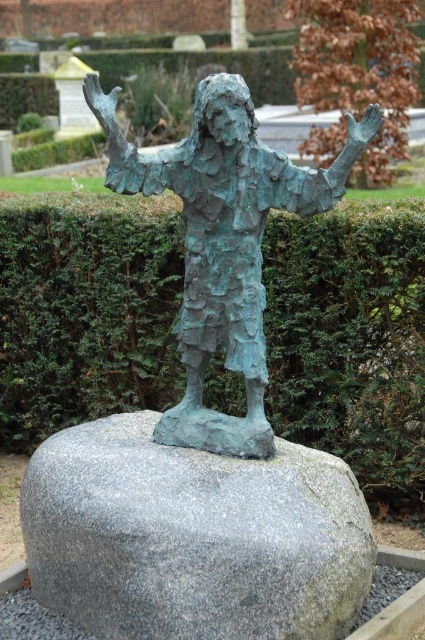
Does green textured hedge at center have a lesser width compared to gray granite rock at center?

No.

Consider the image. Does green textured hedge at center have a greater width compared to gray granite rock at center?

Indeed, green textured hedge at center has a greater width compared to gray granite rock at center.

Locate an element on the screen. green textured hedge at center is located at coordinates (351, 339).

Locate an element on the screen. This screenshot has width=425, height=640. green textured hedge at center is located at coordinates (351, 339).

Looking at this image, between gray granite rock at center and green patina statue at center, which one appears on the right side from the viewer's perspective?

green patina statue at center

Is point (297, 563) closer to camera compared to point (218, 346)?

That is True.

What do you see at coordinates (192, 536) in the screenshot?
I see `gray granite rock at center` at bounding box center [192, 536].

Locate an element on the screen. gray granite rock at center is located at coordinates (192, 536).

Based on the photo, can you confirm if green textured hedge at center is positioned to the right of green patina statue at center?

No, green textured hedge at center is not to the right of green patina statue at center.

Does green textured hedge at center appear over green patina statue at center?

Actually, green textured hedge at center is below green patina statue at center.

Which is behind, point (291, 298) or point (150, 192)?

Point (291, 298)

Where is `green textured hedge at center`? This screenshot has width=425, height=640. green textured hedge at center is located at coordinates (351, 339).